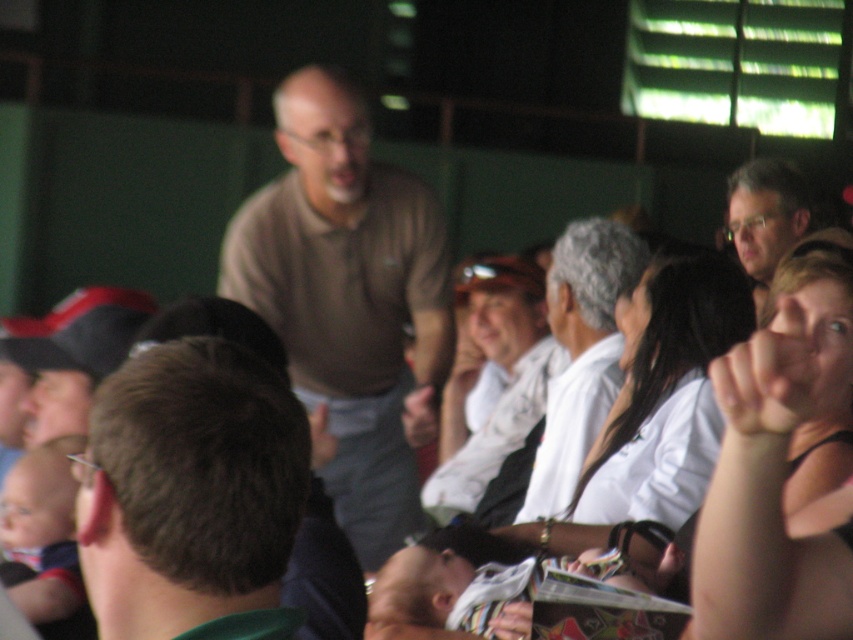
Question: Which of the following is the closest to the observer?

Choices:
 (A) (772, 416)
 (B) (705, 259)

Answer: (A)

Question: Where is matte black tank top at upper right located in relation to matte brown shirt at upper right in the image?

Choices:
 (A) above
 (B) below

Answer: (B)

Question: Which object is farther from the camera taking this photo?

Choices:
 (A) brown matte shirt at center
 (B) brown cotton shirt at center
 (C) matte brown shirt at upper right

Answer: (C)

Question: Observing the image, what is the correct spatial positioning of white silk scarf at center in reference to smooth white shirt at center?

Choices:
 (A) below
 (B) above

Answer: (B)

Question: Which point appears closest to the camera in this image?

Choices:
 (A) (782, 582)
 (B) (236, 556)
 (C) (631, 376)

Answer: (B)

Question: Is white silk shirt at center behind matte brown shirt at upper right?

Choices:
 (A) no
 (B) yes

Answer: (A)